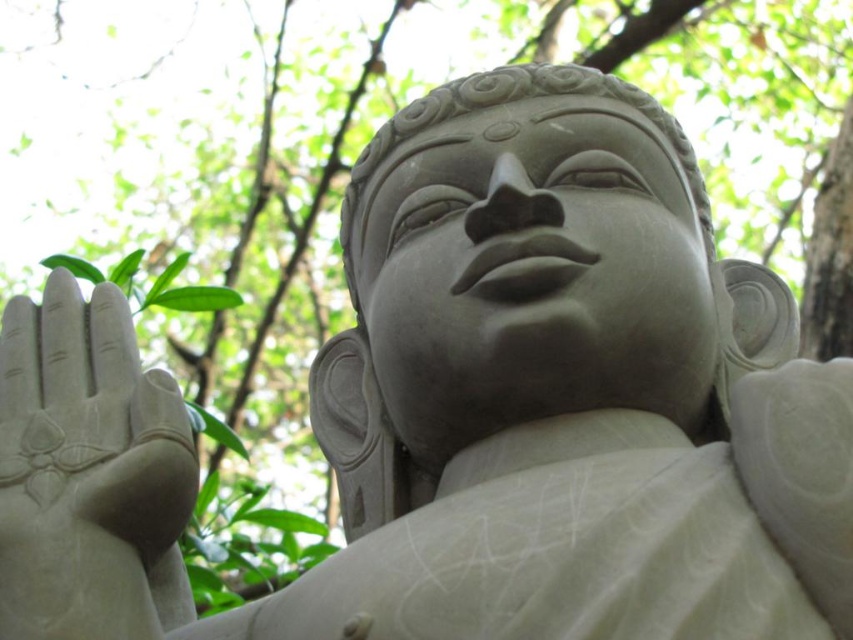
Between smooth stone hand at left and gray stone statue at center, which one appears on the left side from the viewer's perspective?

smooth stone hand at left is more to the left.

Is point (119, 524) behind point (453, 88)?

No.

Is point (102, 589) behind point (712, 248)?

That is False.

Find the location of `smooth stone hand at left`. smooth stone hand at left is located at coordinates (88, 474).